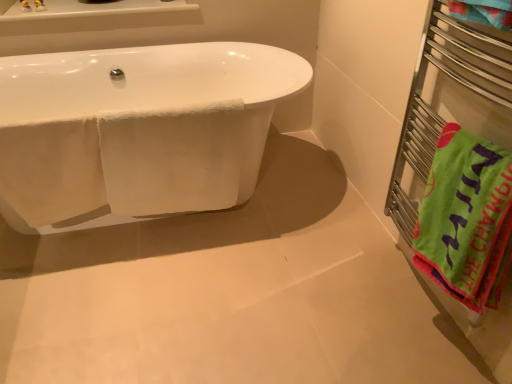
Question: From a real-world perspective, is white glossy bathtub at left positioned under white fluffy towel at center based on gravity?

Choices:
 (A) yes
 (B) no

Answer: (A)

Question: Considering the relative sizes of white glossy bathtub at left and white fluffy towel at center in the image provided, is white glossy bathtub at left thinner than white fluffy towel at center?

Choices:
 (A) yes
 (B) no

Answer: (B)

Question: Does white glossy bathtub at left have a greater height compared to white fluffy towel at center?

Choices:
 (A) no
 (B) yes

Answer: (B)

Question: Is white glossy bathtub at left bigger than white fluffy towel at center?

Choices:
 (A) no
 (B) yes

Answer: (B)

Question: Is white glossy bathtub at left not close to white fluffy towel at center?

Choices:
 (A) yes
 (B) no

Answer: (B)

Question: Is white glossy bathtub at left next to white fluffy towel at center and touching it?

Choices:
 (A) yes
 (B) no

Answer: (B)

Question: Is metal towel rack at right positioned with its back to white fluffy towel at center?

Choices:
 (A) no
 (B) yes

Answer: (A)

Question: Does metal towel rack at right appear on the right side of white fluffy towel at center?

Choices:
 (A) no
 (B) yes

Answer: (B)

Question: Can you confirm if metal towel rack at right is positioned to the left of white fluffy towel at center?

Choices:
 (A) yes
 (B) no

Answer: (B)

Question: Considering the relative sizes of metal towel rack at right and white fluffy towel at center in the image provided, is metal towel rack at right smaller than white fluffy towel at center?

Choices:
 (A) yes
 (B) no

Answer: (B)

Question: Is metal towel rack at right further to camera compared to white fluffy towel at center?

Choices:
 (A) no
 (B) yes

Answer: (A)

Question: Can you confirm if metal towel rack at right is thinner than white fluffy towel at center?

Choices:
 (A) no
 (B) yes

Answer: (A)

Question: Is green cotton beach towel at right located outside metal towel rack at right?

Choices:
 (A) no
 (B) yes

Answer: (A)